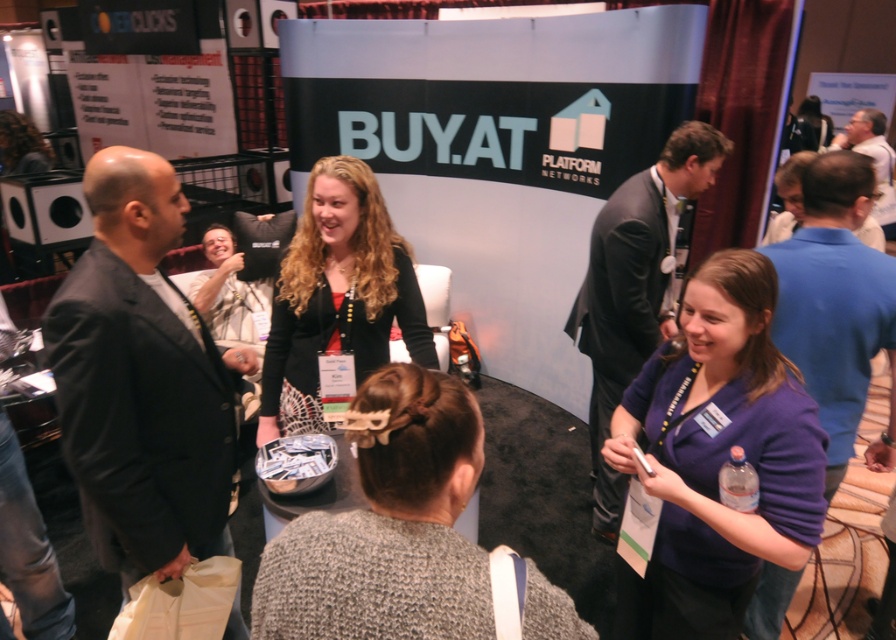
Question: Does dark gray suit at left appear under dark suit at center?

Choices:
 (A) no
 (B) yes

Answer: (B)

Question: Where is purple fabric shirt at lower right located in relation to white shirt at center in the image?

Choices:
 (A) above
 (B) below

Answer: (B)

Question: Considering the relative positions of dark gray suit at left and black matte blazer at center in the image provided, where is dark gray suit at left located with respect to black matte blazer at center?

Choices:
 (A) below
 (B) above

Answer: (A)

Question: Which object is farther from the camera taking this photo?

Choices:
 (A) blue cotton shirt at right
 (B) dark suit at center
 (C) black matte blazer at center
 (D) knitted gray sweater at center

Answer: (B)

Question: Which point is farther from the camera taking this photo?

Choices:
 (A) (x=343, y=221)
 (B) (x=649, y=605)
 (C) (x=651, y=237)
 (D) (x=63, y=369)

Answer: (C)

Question: Which object is farther from the camera taking this photo?

Choices:
 (A) purple fabric shirt at lower right
 (B) knitted gray sweater at center
 (C) dark suit at center
 (D) blue cotton shirt at right

Answer: (C)